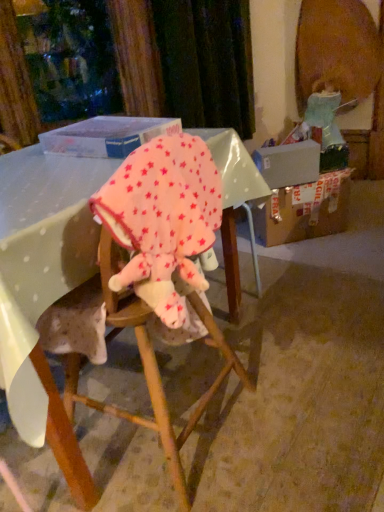
Question: Should I look upward or downward to see pink fleece baby elephant at center?

Choices:
 (A) down
 (B) up

Answer: (B)

Question: Does pink fleece baby elephant at center have a smaller size compared to pink fleece blanket at center?

Choices:
 (A) yes
 (B) no

Answer: (A)

Question: Is pink fleece baby elephant at center outside of pink fleece blanket at center?

Choices:
 (A) yes
 (B) no

Answer: (B)

Question: Does pink fleece baby elephant at center have a greater width compared to pink fleece blanket at center?

Choices:
 (A) yes
 (B) no

Answer: (B)

Question: From the image's perspective, does pink fleece baby elephant at center appear higher than pink fleece blanket at center?

Choices:
 (A) yes
 (B) no

Answer: (A)

Question: Is pink fleece baby elephant at center shorter than pink fleece blanket at center?

Choices:
 (A) no
 (B) yes

Answer: (B)

Question: Is pink fleece baby elephant at center bigger than pink fleece blanket at center?

Choices:
 (A) no
 (B) yes

Answer: (A)

Question: Is translucent plastic box at upper center a part of pink fleece baby elephant at center?

Choices:
 (A) no
 (B) yes

Answer: (A)

Question: Is pink fleece baby elephant at center smaller than translucent plastic box at upper center?

Choices:
 (A) no
 (B) yes

Answer: (A)

Question: Is pink fleece baby elephant at center in front of translucent plastic box at upper center?

Choices:
 (A) no
 (B) yes

Answer: (B)

Question: From the image's perspective, is pink fleece baby elephant at center below translucent plastic box at upper center?

Choices:
 (A) no
 (B) yes

Answer: (B)

Question: Is pink fleece baby elephant at center at the right side of translucent plastic box at upper center?

Choices:
 (A) no
 (B) yes

Answer: (B)

Question: Is pink fleece baby elephant at center further to camera compared to translucent plastic box at upper center?

Choices:
 (A) no
 (B) yes

Answer: (A)

Question: From the image's perspective, does pink fleece blanket at center appear lower than pink fleece baby elephant at center?

Choices:
 (A) no
 (B) yes

Answer: (B)